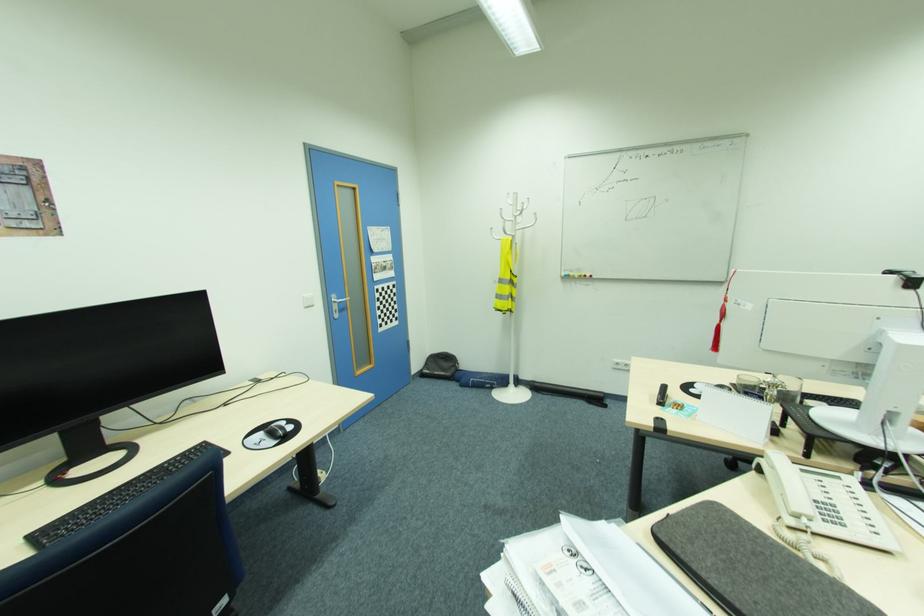
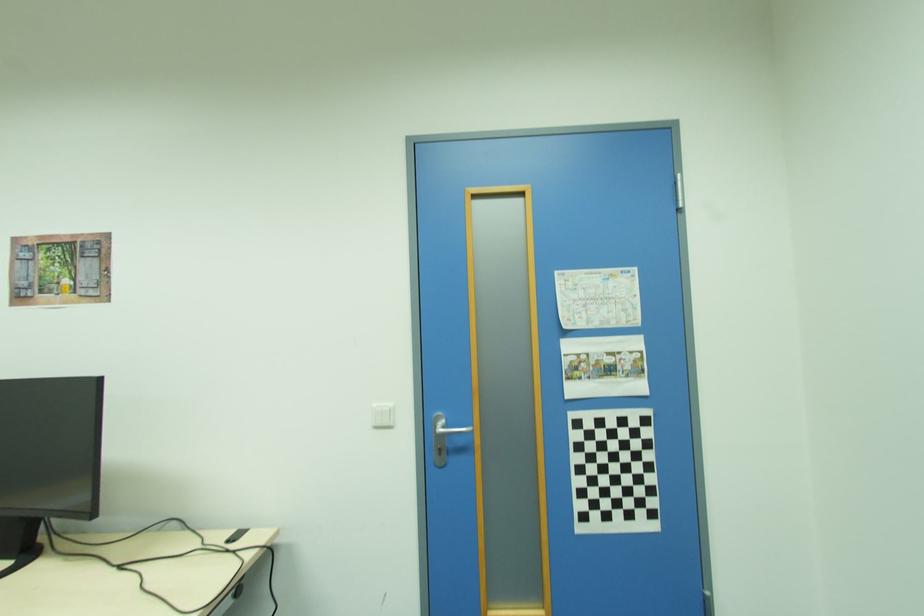
In the second image, find the point that corresponds to the point at 379,269 in the first image.

(579, 369)